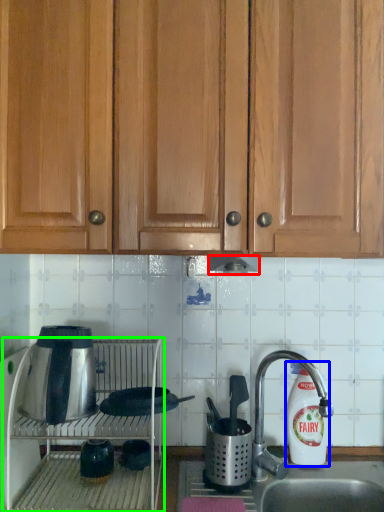
Question: Which is nearer to the exhaust hood (highlighted by a red box)? cleaning product (highlighted by a blue box) or oven (highlighted by a green box).

Choices:
 (A) cleaning product
 (B) oven

Answer: (A)